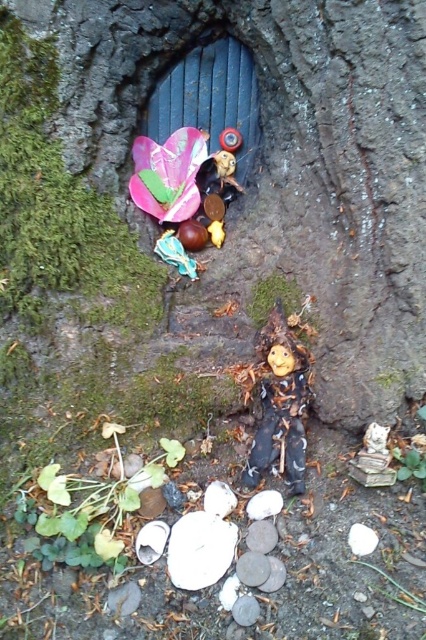
Question: Is wooden doll at center bigger than shiny plastic flower at upper left?

Choices:
 (A) no
 (B) yes

Answer: (A)

Question: Does wooden doll at center have a larger size compared to shiny plastic flower at upper left?

Choices:
 (A) yes
 (B) no

Answer: (B)

Question: Can you confirm if wooden doll at center is wider than smooth white stone at lower center?

Choices:
 (A) yes
 (B) no

Answer: (A)

Question: Which of the following is the farthest from the observer?

Choices:
 (A) wooden doll at center
 (B) smooth white stone at lower center

Answer: (A)

Question: Based on their relative distances, which object is farther from the smooth white stone at lower center?

Choices:
 (A) shiny plastic flower at upper left
 (B) wooden doll at center

Answer: (A)

Question: Which point appears closest to the camera in this image?

Choices:
 (A) (287, 344)
 (B) (198, 147)
 (C) (270, 564)

Answer: (C)